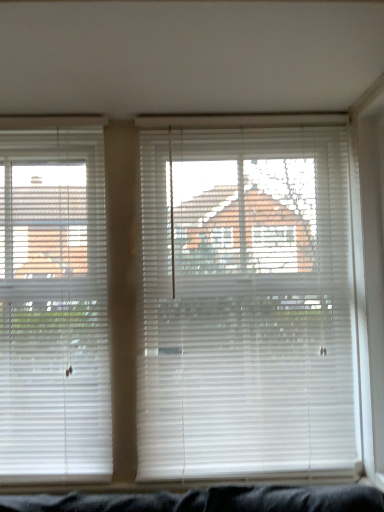
Question: Considering the positions of white plastic blinds at center, the 2th window blind when ordered from left to right, and white plastic blinds at left, marked as the 2th window blind in a right-to-left arrangement, in the image, is white plastic blinds at center, the 2th window blind when ordered from left to right, wider or thinner than white plastic blinds at left, marked as the 2th window blind in a right-to-left arrangement,?

Choices:
 (A) wide
 (B) thin

Answer: (A)

Question: From the image's perspective, relative to white plastic blinds at left, marked as the 2th window blind in a right-to-left arrangement, is white plastic blinds at center, the 2th window blind when ordered from left to right, above or below?

Choices:
 (A) below
 (B) above

Answer: (B)

Question: Visually, is white plastic blinds at center, the first window blind from the right, positioned to the left or to the right of white plastic blinds at left, marked as the 2th window blind in a right-to-left arrangement?

Choices:
 (A) right
 (B) left

Answer: (A)

Question: From the image's perspective, is white plastic blinds at left, positioned as the 1th window blind in left-to-right order, above or below white plastic blinds at center, the 2th window blind when ordered from left to right?

Choices:
 (A) above
 (B) below

Answer: (B)

Question: Is white plastic blinds at left, positioned as the 1th window blind in left-to-right order, inside or outside of white plastic blinds at center, the first window blind from the right?

Choices:
 (A) outside
 (B) inside

Answer: (A)

Question: Is white plastic blinds at left, marked as the 2th window blind in a right-to-left arrangement, in front of or behind white plastic blinds at center, the first window blind from the right, in the image?

Choices:
 (A) front
 (B) behind

Answer: (B)

Question: From a real-world perspective, is white plastic blinds at left, positioned as the 1th window blind in left-to-right order, positioned above or below white plastic blinds at center, the first window blind from the right?

Choices:
 (A) above
 (B) below

Answer: (A)